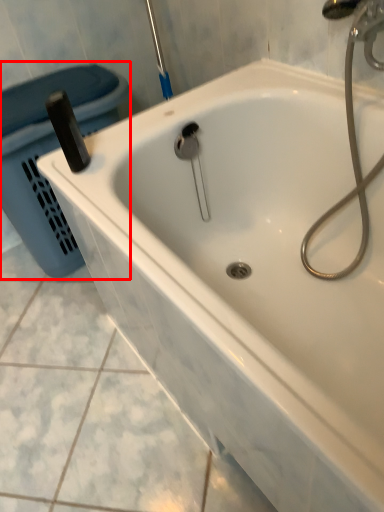
Question: Considering the relative positions of laundry basket (annotated by the red box) and plumbing fixture in the image provided, where is laundry basket (annotated by the red box) located with respect to the staircase?

Choices:
 (A) right
 (B) left

Answer: (B)